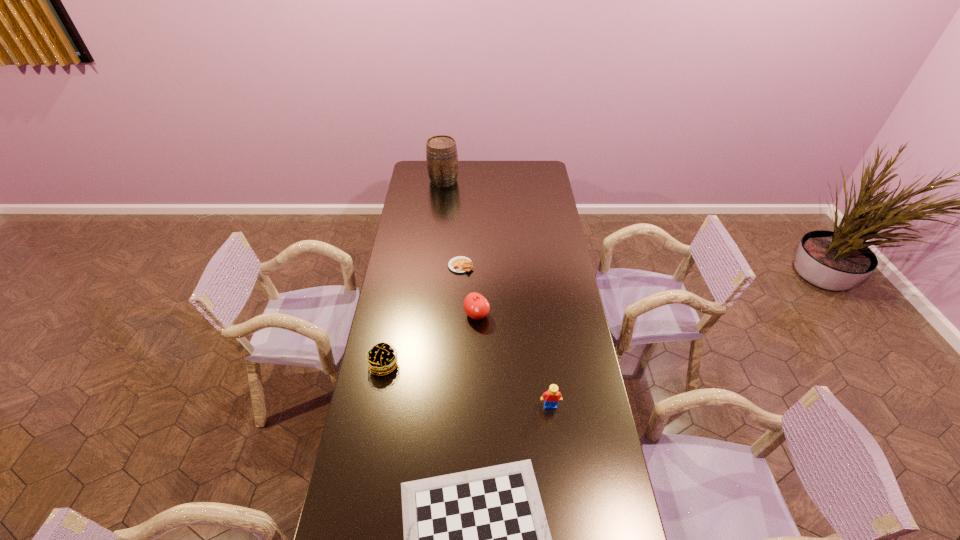
At what (x,y) coordinates should I click in order to perform the action: click on vacant area situated on the front of the leftmost object. Please return your answer as a coordinate pair (x, y). Looking at the image, I should click on (367, 454).

I want to click on vacant space located on the front of the omelet, so click(x=459, y=311).

This screenshot has width=960, height=540. I want to click on object that is positioned at the far edge, so click(441, 151).

The width and height of the screenshot is (960, 540). I want to click on cider located at the left edge, so click(441, 151).

Identify the location of patty that is at the left edge. (381, 358).

The width and height of the screenshot is (960, 540). In order to click on object that is positioned at the right edge in this screenshot , I will do `click(552, 396)`.

Locate an element on the screen. The width and height of the screenshot is (960, 540). object present at the far left corner is located at coordinates (441, 151).

Where is `vacant area at the left edge of the desktop`? The width and height of the screenshot is (960, 540). vacant area at the left edge of the desktop is located at coordinates (396, 425).

Find the location of a particular element. Image resolution: width=960 pixels, height=540 pixels. free space at the right edge is located at coordinates pyautogui.click(x=582, y=359).

Identify the location of vacant space at the far right corner of the desktop. click(x=524, y=169).